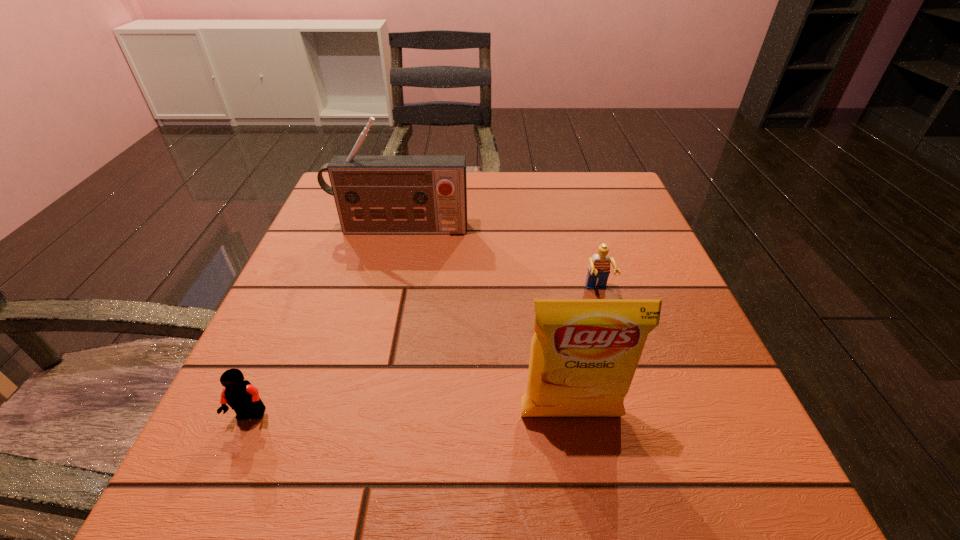
Locate an element on the screen. Image resolution: width=960 pixels, height=540 pixels. radio receiver located at the left edge is located at coordinates [373, 194].

Where is `Lego present at the left edge`? The width and height of the screenshot is (960, 540). Lego present at the left edge is located at coordinates (243, 397).

Identify the location of object present at the right edge. (598, 272).

You are a GUI agent. You are given a task and a screenshot of the screen. Output one action in this format:
    pyautogui.click(x=<x>, y=<y>)
    Task: Click on the object present at the far left corner
    Image resolution: width=960 pixels, height=540 pixels.
    Given the screenshot: What is the action you would take?
    pyautogui.click(x=373, y=194)

At what (x,y) coordinates should I click in order to perform the action: click on vacant space at the far edge of the desktop. Please return your answer as a coordinate pair (x, y). Looking at the image, I should click on (505, 187).

The height and width of the screenshot is (540, 960). Find the location of `vacant space at the near edge`. vacant space at the near edge is located at coordinates (321, 515).

In the image, there is a desktop. Where is `vacant area at the left edge`? vacant area at the left edge is located at coordinates (249, 366).

Identify the location of free location at the right edge of the desktop. (671, 364).

You are a GUI agent. You are given a task and a screenshot of the screen. Output one action in this format:
    pyautogui.click(x=<x>, y=<y>)
    Task: Click on the free location at the near left corner
    
    Given the screenshot: What is the action you would take?
    pyautogui.click(x=296, y=454)

The width and height of the screenshot is (960, 540). Identify the location of vacant space at the far right corner. (566, 184).